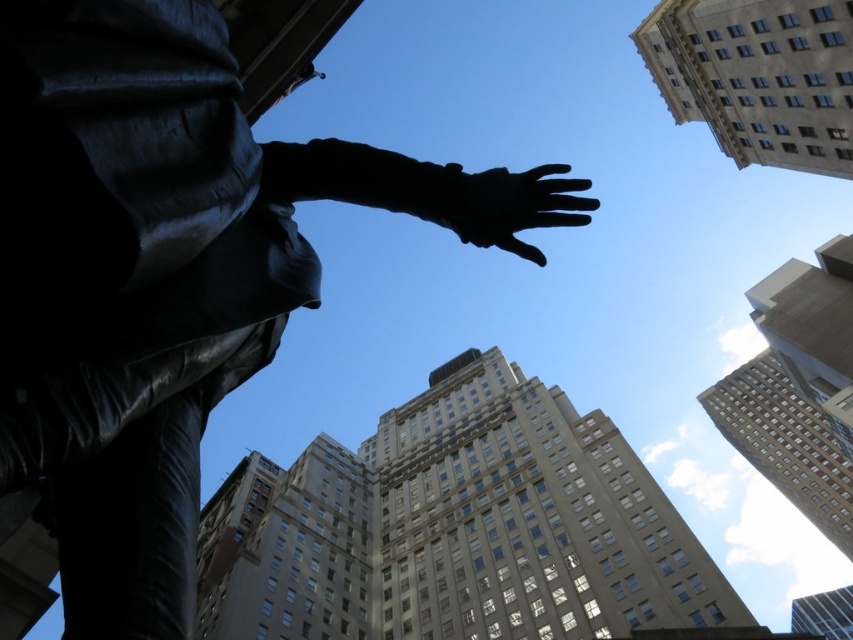
Question: Can you confirm if black polished statue at center is positioned above black matte hand at upper center?

Choices:
 (A) no
 (B) yes

Answer: (A)

Question: Does black polished statue at center lie in front of black matte hand at upper center?

Choices:
 (A) no
 (B) yes

Answer: (B)

Question: Is black polished statue at center to the right of black matte hand at upper center from the viewer's perspective?

Choices:
 (A) no
 (B) yes

Answer: (A)